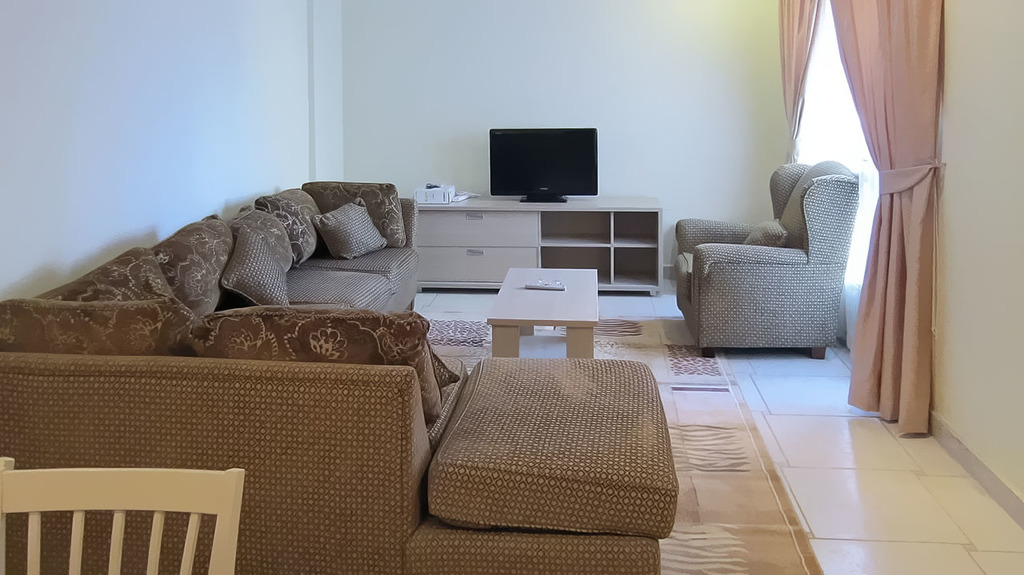
This screenshot has width=1024, height=575. Find the location of `television`. television is located at coordinates (569, 166).